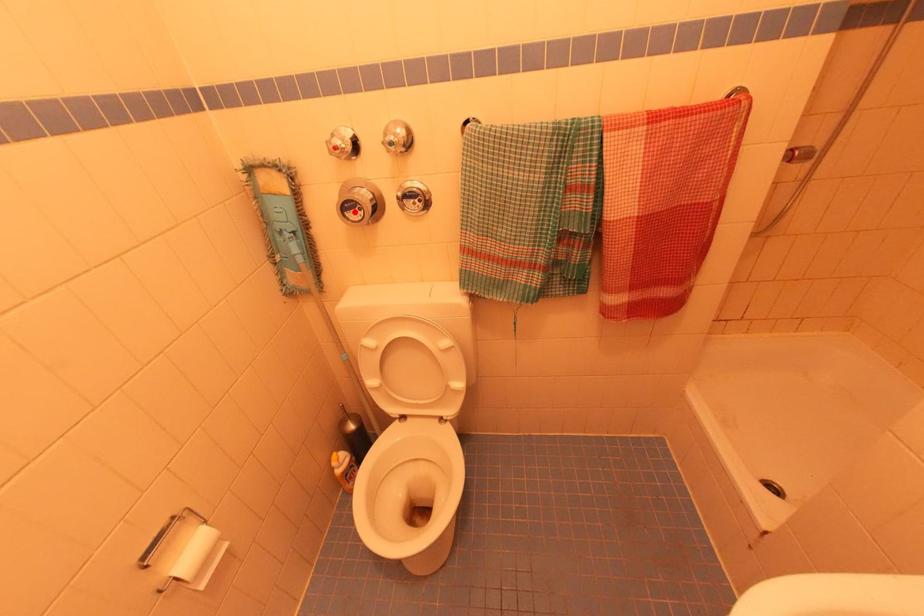
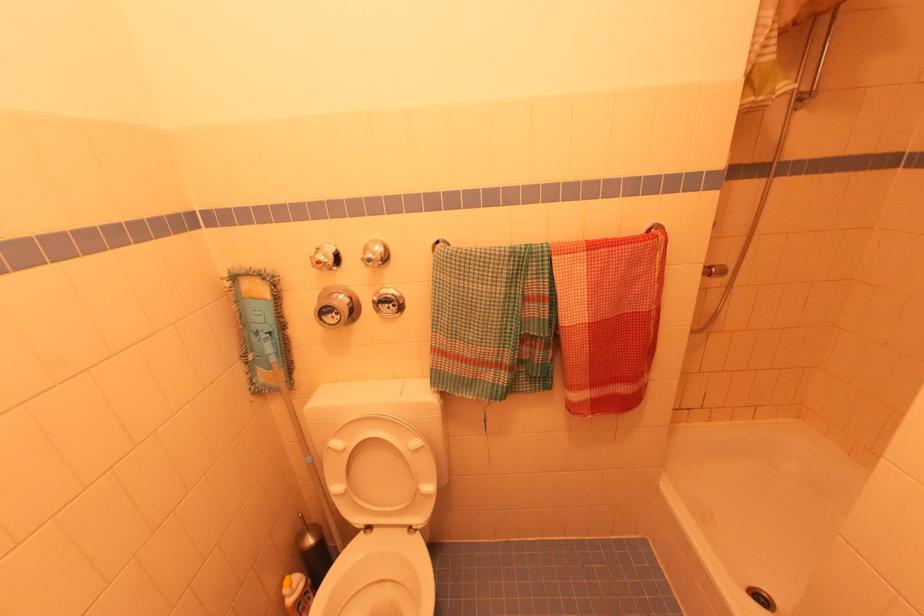
Question: I am providing you with two images of the same scene from different viewpoints. A red point is marked on the first image. Can you still see the location of the red point in image 2?

Choices:
 (A) Yes
 (B) No

Answer: (A)